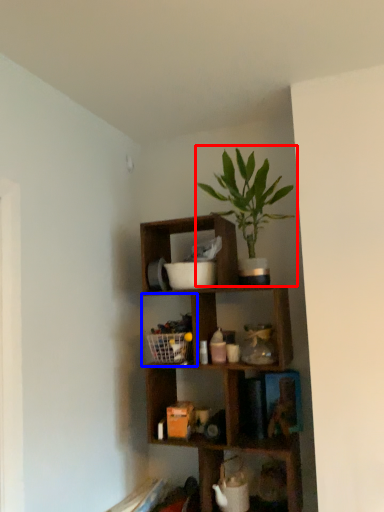
Question: Which object appears closest to the camera in this image, houseplant (highlighted by a red box) or cabinet (highlighted by a blue box)?

Choices:
 (A) houseplant
 (B) cabinet

Answer: (A)